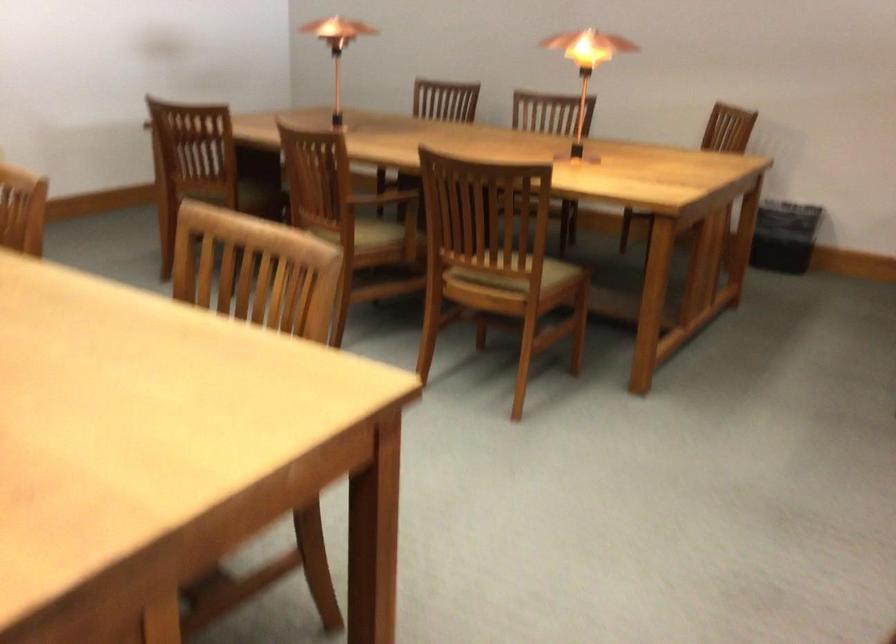
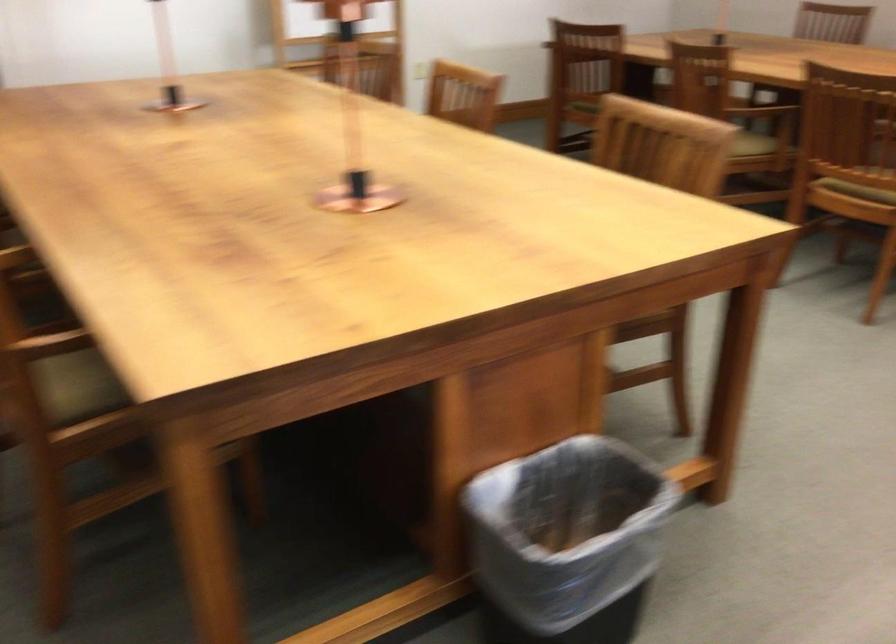
The point at [488,298] is marked in the first image. Where is the corresponding point in the second image?

(857, 191)